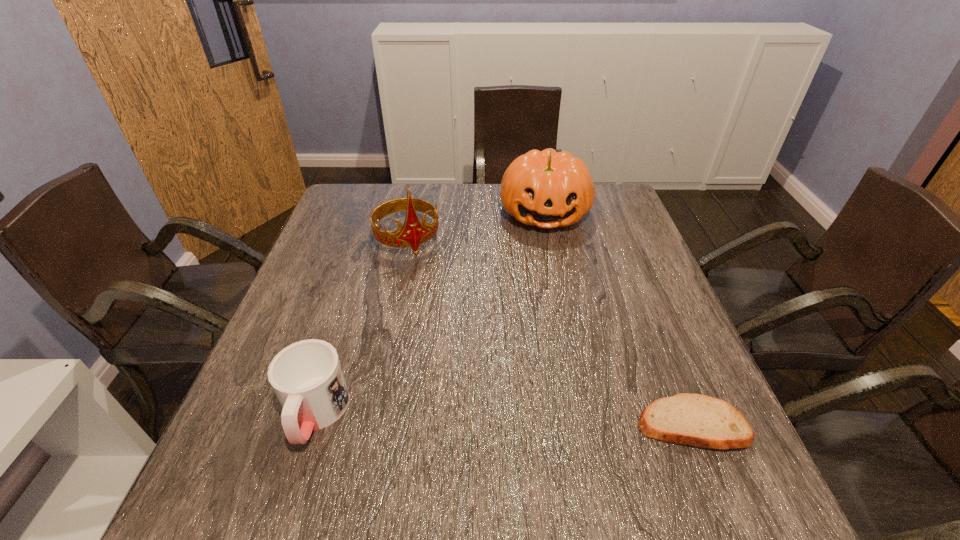
Locate an element on the screen. The height and width of the screenshot is (540, 960). object that is the second closest to the shortest object is located at coordinates (307, 378).

Image resolution: width=960 pixels, height=540 pixels. Identify the location of free region that satisfies the following two spatial constraints: 1. on the side of the shortest object with the handle; 2. on the left side of the third tallest object. (312, 424).